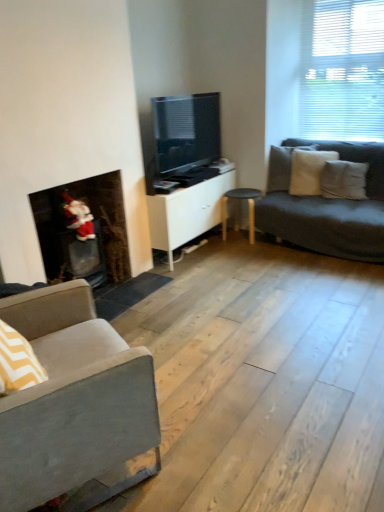
Question: Does black wood stool at center have a greater height compared to white soft pillow at right, which is the third pillow in left-to-right order?

Choices:
 (A) no
 (B) yes

Answer: (B)

Question: Considering the relative positions of black wood stool at center and white soft pillow at right, placed as the first pillow when sorted from right to left, in the image provided, is black wood stool at center to the right of white soft pillow at right, placed as the first pillow when sorted from right to left, from the viewer's perspective?

Choices:
 (A) no
 (B) yes

Answer: (A)

Question: Is black wood stool at center positioned in front of white soft pillow at right, which is the third pillow in left-to-right order?

Choices:
 (A) no
 (B) yes

Answer: (A)

Question: From a real-world perspective, is black wood stool at center physically below white soft pillow at right, which is the third pillow in left-to-right order?

Choices:
 (A) yes
 (B) no

Answer: (A)

Question: Is black wood stool at center oriented away from white soft pillow at right, placed as the first pillow when sorted from right to left?

Choices:
 (A) no
 (B) yes

Answer: (A)

Question: Would you say black wood stool at center is a long distance from white soft pillow at right, which is the third pillow in left-to-right order?

Choices:
 (A) no
 (B) yes

Answer: (A)

Question: Is white soft pillow at right, placed as the first pillow when sorted from right to left, positioned in front of white matte cabinet at center?

Choices:
 (A) yes
 (B) no

Answer: (B)

Question: From a real-world perspective, is white soft pillow at right, placed as the first pillow when sorted from right to left, positioned over white matte cabinet at center based on gravity?

Choices:
 (A) no
 (B) yes

Answer: (B)

Question: Considering the relative positions of white soft pillow at right, placed as the first pillow when sorted from right to left, and white matte cabinet at center in the image provided, is white soft pillow at right, placed as the first pillow when sorted from right to left, behind white matte cabinet at center?

Choices:
 (A) yes
 (B) no

Answer: (A)

Question: Does white soft pillow at right, which is the third pillow in left-to-right order, have a smaller size compared to white matte cabinet at center?

Choices:
 (A) no
 (B) yes

Answer: (B)

Question: Is white soft pillow at right, placed as the first pillow when sorted from right to left, shorter than white matte cabinet at center?

Choices:
 (A) yes
 (B) no

Answer: (A)

Question: Considering the relative positions of white soft pillow at right, placed as the first pillow when sorted from right to left, and white matte cabinet at center in the image provided, is white soft pillow at right, placed as the first pillow when sorted from right to left, to the right of white matte cabinet at center from the viewer's perspective?

Choices:
 (A) no
 (B) yes

Answer: (B)

Question: Considering the relative sizes of matte black tv at center and gray fabric couch at left in the image provided, is matte black tv at center smaller than gray fabric couch at left?

Choices:
 (A) no
 (B) yes

Answer: (B)